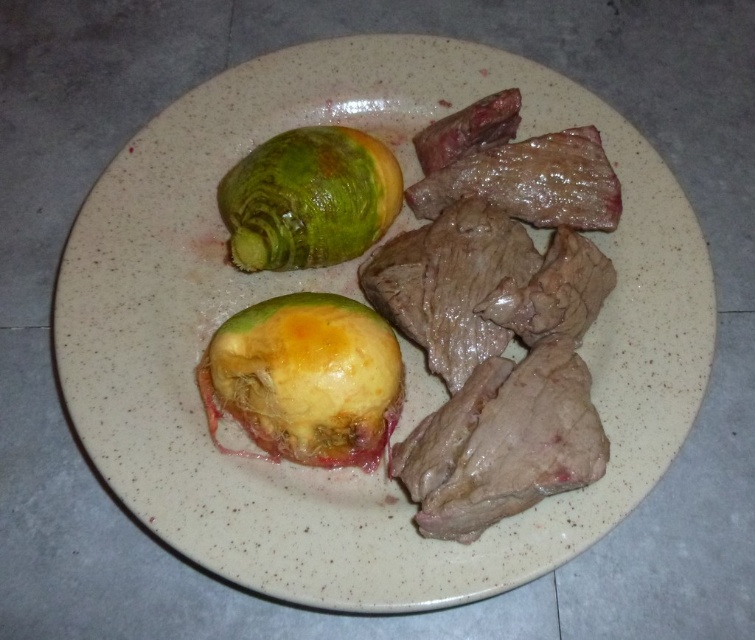
You are a food delivery person who needs to describe the position of the yellowish matte fruit at center and the green matte avocado at upper left to the customer. Based on the scene, which one is located higher up?

The green matte avocado at upper left is located higher up than the yellowish matte fruit at center.